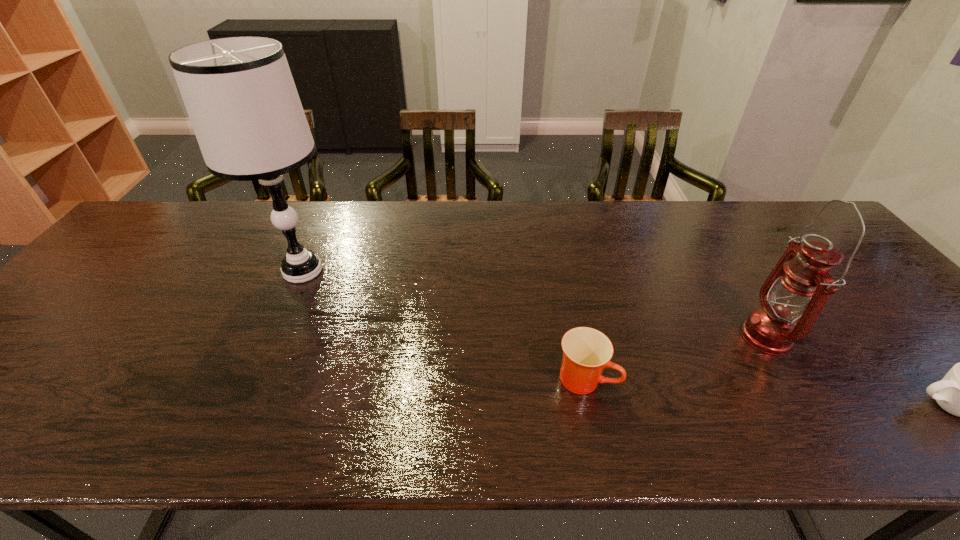
Image resolution: width=960 pixels, height=540 pixels. Find the location of `the leftmost object`. the leftmost object is located at coordinates (239, 93).

This screenshot has width=960, height=540. Find the location of `the tallest object`. the tallest object is located at coordinates (239, 93).

Find the location of a particular element. The height and width of the screenshot is (540, 960). the second tallest object is located at coordinates (799, 286).

Locate an element on the screen. The width and height of the screenshot is (960, 540). oil lamp is located at coordinates (799, 286).

The width and height of the screenshot is (960, 540). What are the coordinates of `the second object from left to right` in the screenshot? It's located at (586, 351).

At what (x,y) coordinates should I click in order to perform the action: click on the left cup. Please return your answer as a coordinate pair (x, y). This screenshot has width=960, height=540. Looking at the image, I should click on (586, 351).

Find the location of `vacant space located on the left of the leftmost object`. vacant space located on the left of the leftmost object is located at coordinates (150, 271).

This screenshot has height=540, width=960. In order to click on free space located 0.270m on the back of the oil lamp in this screenshot , I will do `click(708, 245)`.

At what (x,y) coordinates should I click in order to perform the action: click on free space located on the back of the third tallest object. Please return your answer as a coordinate pair (x, y). The image size is (960, 540). Looking at the image, I should click on (559, 254).

In the image, there is a desktop. Where is `vacant space at the far edge`? This screenshot has width=960, height=540. vacant space at the far edge is located at coordinates (630, 212).